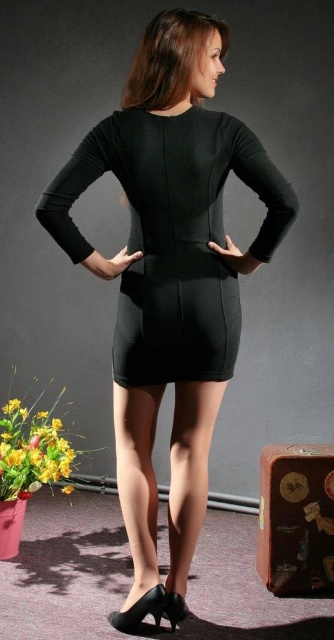
Question: Observing the image, what is the correct spatial positioning of black matte dress at center in reference to satin smooth stockings at lower center?

Choices:
 (A) below
 (B) above

Answer: (B)

Question: Which object is positioned closest to the black matte dress at center?

Choices:
 (A) leather suitcase at lower right
 (B) satin smooth stockings at lower center

Answer: (B)

Question: In this image, where is black matte dress at center located relative to leather suitcase at lower right?

Choices:
 (A) below
 (B) above

Answer: (B)

Question: Which point is farther to the camera?

Choices:
 (A) (174, 529)
 (B) (263, 534)
 (C) (143, 326)

Answer: (B)

Question: Is black matte dress at center to the right of leather suitcase at lower right from the viewer's perspective?

Choices:
 (A) yes
 (B) no

Answer: (B)

Question: Which point appears closest to the camera in this image?

Choices:
 (A) (192, 108)
 (B) (192, 515)

Answer: (A)